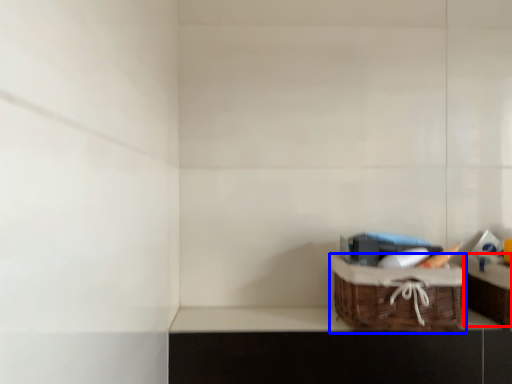
Question: Which point is closer to the camera, cabinetry (highlighted by a red box) or picnic basket (highlighted by a blue box)?

Choices:
 (A) cabinetry
 (B) picnic basket

Answer: (B)